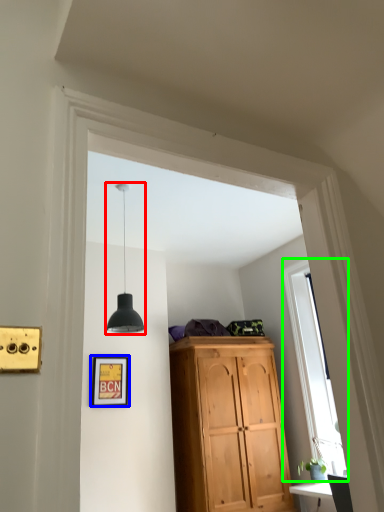
Question: Based on their relative distances, which object is farther from light fixture (highlighted by a red box)? Choose from picture frame (highlighted by a blue box) and window (highlighted by a green box).

Choices:
 (A) picture frame
 (B) window

Answer: (B)